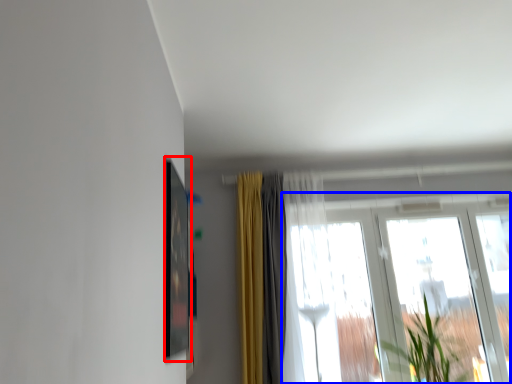
Question: Which object appears closest to the camera in this image, picture frame (highlighted by a red box) or window (highlighted by a blue box)?

Choices:
 (A) picture frame
 (B) window

Answer: (A)